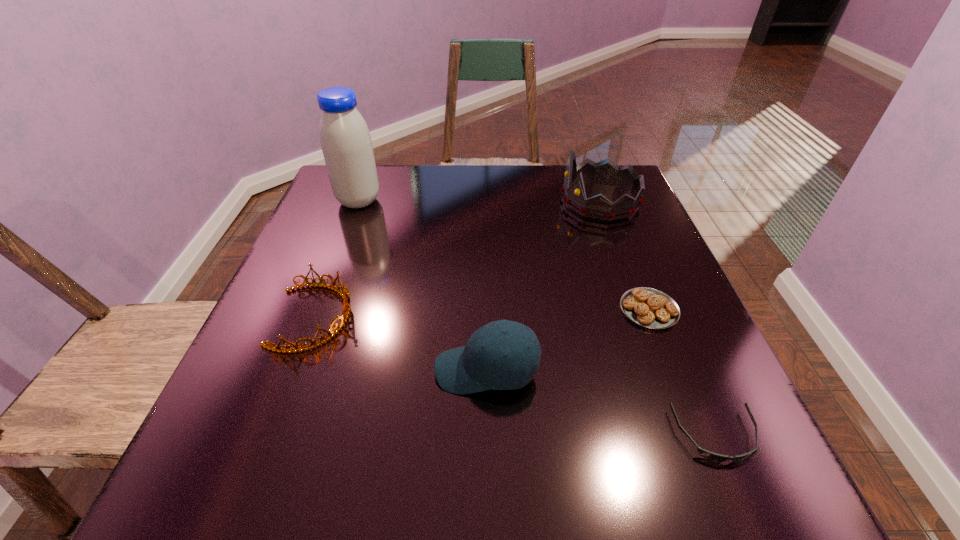
I want to click on free space located 0.090m on the right of the tallest object, so click(x=416, y=201).

At what (x,y) coordinates should I click in order to perform the action: click on vacant space located 0.270m at the front of the farther tiara with jewels. Please return your answer as a coordinate pair (x, y). The image size is (960, 540). Looking at the image, I should click on (457, 201).

Image resolution: width=960 pixels, height=540 pixels. Find the location of `vacant point located 0.290m at the front of the farther tiara with jewels`. vacant point located 0.290m at the front of the farther tiara with jewels is located at coordinates (449, 201).

Find the location of a particular element. The height and width of the screenshot is (540, 960). vacant space located 0.230m at the front of the farther tiara with jewels is located at coordinates (472, 201).

Locate an element on the screen. The width and height of the screenshot is (960, 540). vacant region located on the front-facing side of the third object from left to right is located at coordinates (242, 370).

Identify the location of vacant space located 0.120m on the front-facing side of the third object from left to right. (365, 370).

You are a GUI agent. You are given a task and a screenshot of the screen. Output one action in this format:
    pyautogui.click(x=<x>, y=<y>)
    Task: Click on the free space located 0.270m on the front-facing side of the third object from left to right
    
    Given the screenshot: What is the action you would take?
    pyautogui.click(x=276, y=370)

Where is `vacant space situated on the front-facing side of the shorter tiara`? The image size is (960, 540). vacant space situated on the front-facing side of the shorter tiara is located at coordinates (406, 317).

Identify the location of vacant position located 0.320m on the left of the fifth tallest object. This screenshot has width=960, height=540. (456, 309).

Identify the location of soya milk present at the far edge. (345, 139).